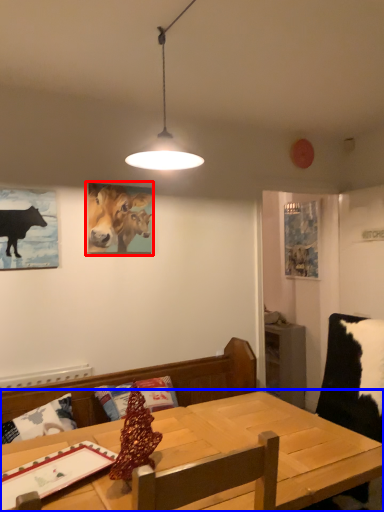
Question: Among these objects, which one is farthest to the camera, picture frame (highlighted by a red box) or table (highlighted by a blue box)?

Choices:
 (A) picture frame
 (B) table

Answer: (A)